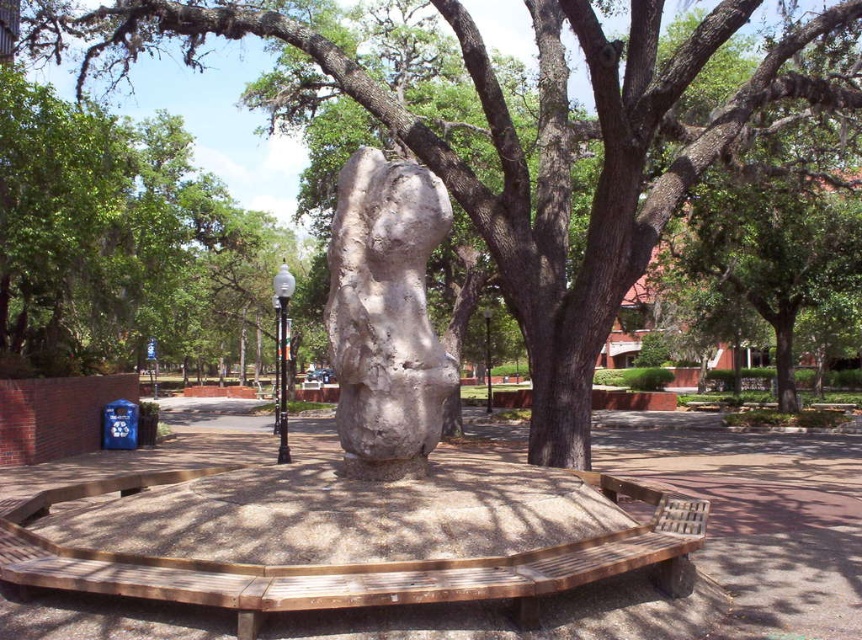
Question: Can you confirm if green leafy tree at center is positioned below white stone sculpture at center?

Choices:
 (A) no
 (B) yes

Answer: (A)

Question: Can you confirm if wooden bench at center is positioned below white stone sculpture at center?

Choices:
 (A) no
 (B) yes

Answer: (B)

Question: Which point is closer to the camera?

Choices:
 (A) wooden bench at center
 (B) green leafy tree at center
 (C) white stone sculpture at center

Answer: (A)

Question: Can you confirm if green leafy tree at center is wider than white stone sculpture at center?

Choices:
 (A) yes
 (B) no

Answer: (A)

Question: Which of the following is the closest to the observer?

Choices:
 (A) (431, 593)
 (B) (270, 28)
 (C) (395, 321)

Answer: (A)

Question: Which of the following is the closest to the observer?

Choices:
 (A) (392, 182)
 (B) (157, 545)

Answer: (B)